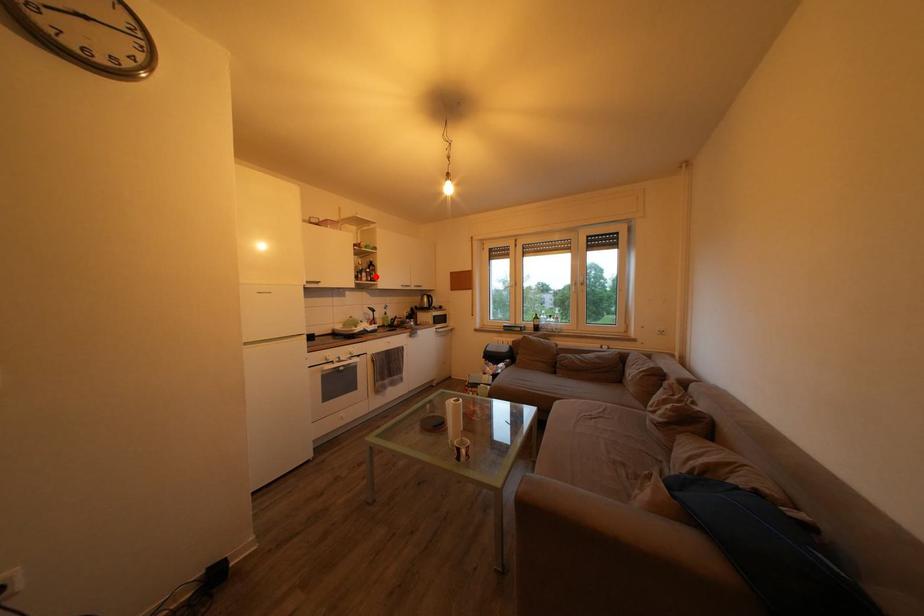
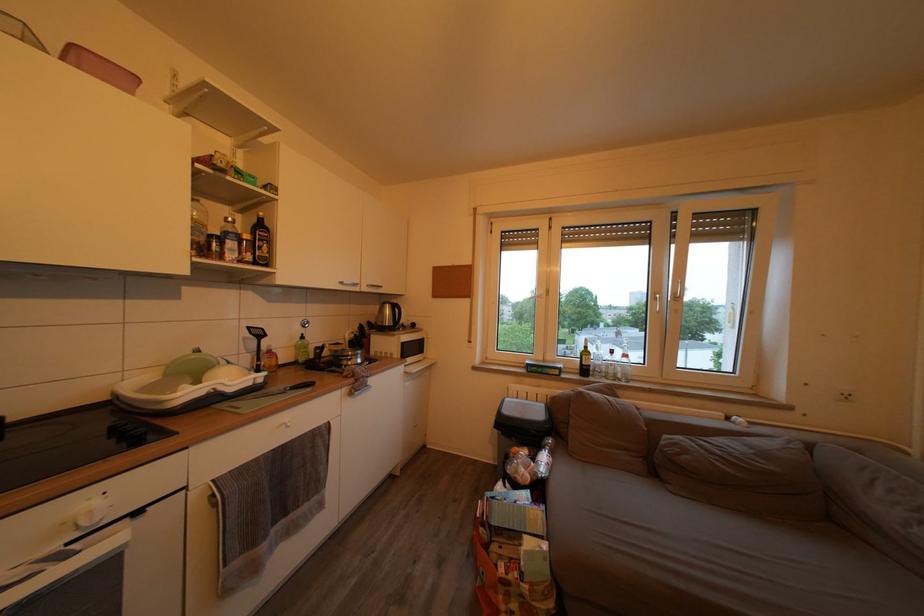
Find the pixel in the second image that matches the highlighted location in the first image.

(253, 243)